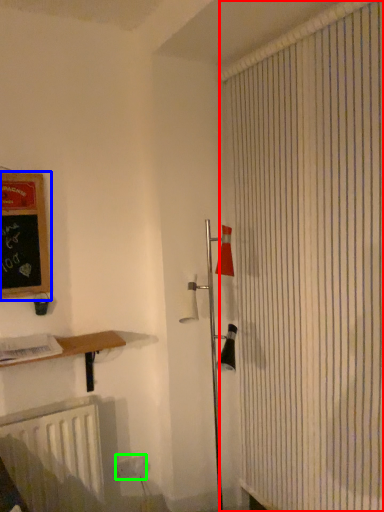
Question: Based on their relative distances, which object is farther from shower curtain (highlighted by a red box)? Choose from bulletin board (highlighted by a blue box) and electric outlet (highlighted by a green box).

Choices:
 (A) bulletin board
 (B) electric outlet

Answer: (B)